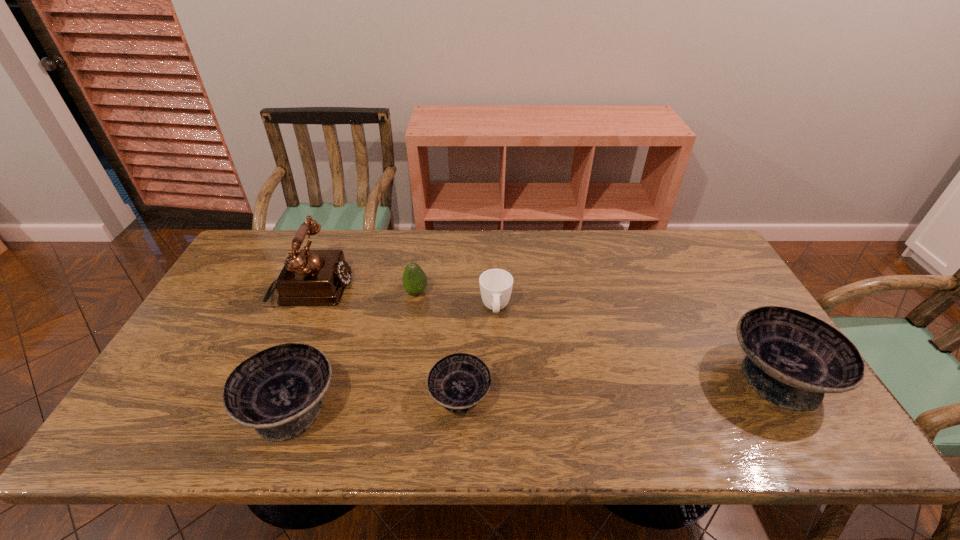
Please mark a free spot for a new bowl to balance the arrangement. Please provide its 2D coordinates. Your answer should be formatted as a tuple, i.e. [(x, y)], where the tuple contains the x and y coordinates of a point satisfying the conditions above.

[(622, 386)]